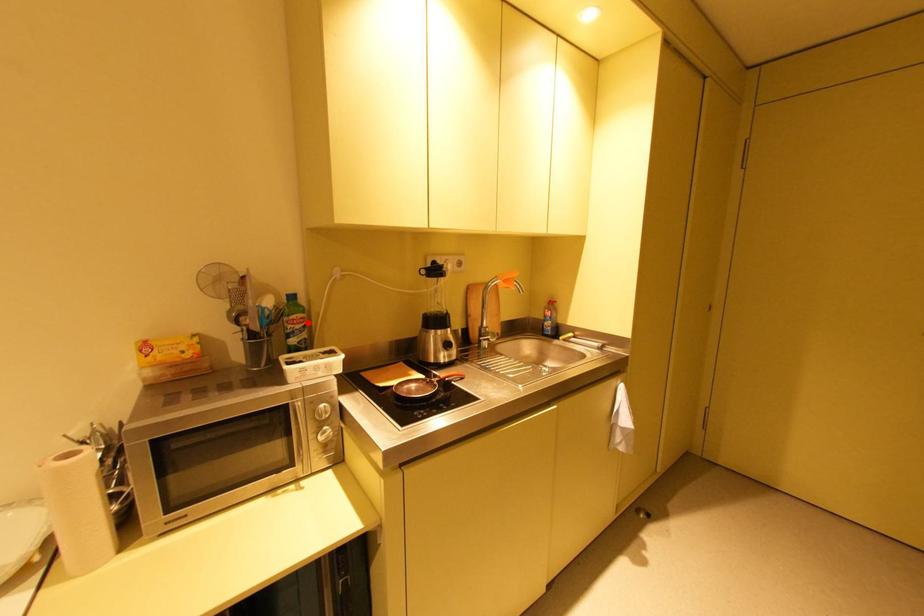
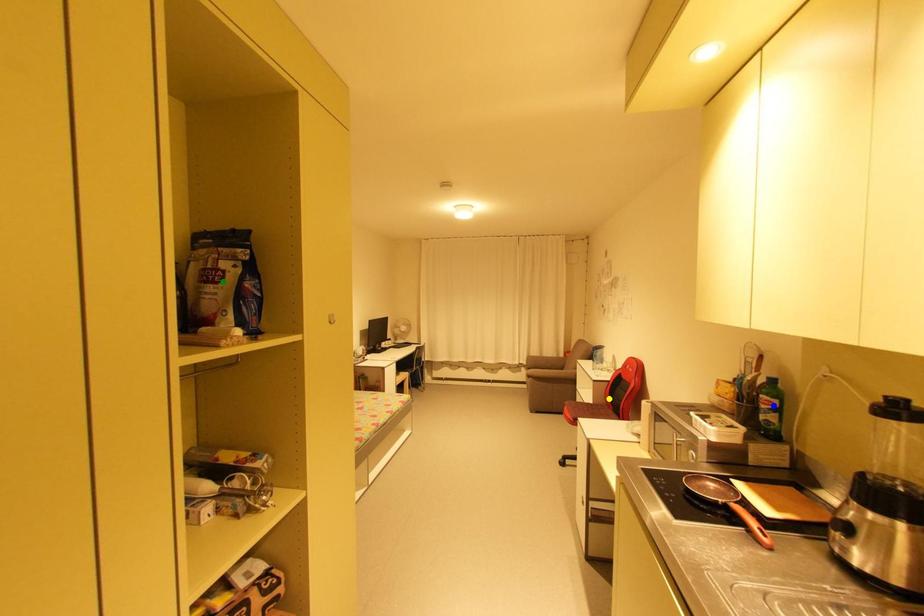
Question: I am providing you with two images of the same scene from different viewpoints. A red point is marked on the first image. You are given multiple points on the second image. Which point in image 2 is actually the same real-world point as the red point in image 1?

Choices:
 (A) blue point
 (B) green point
 (C) yellow point

Answer: (A)